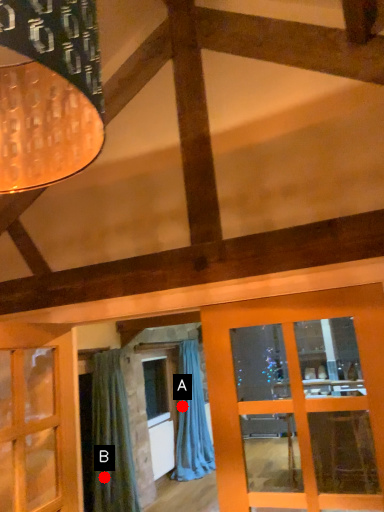
Question: Two points are circled on the image, labeled by A and B beside each circle. Which point is closer to the camera?

Choices:
 (A) A is closer
 (B) B is closer

Answer: (B)